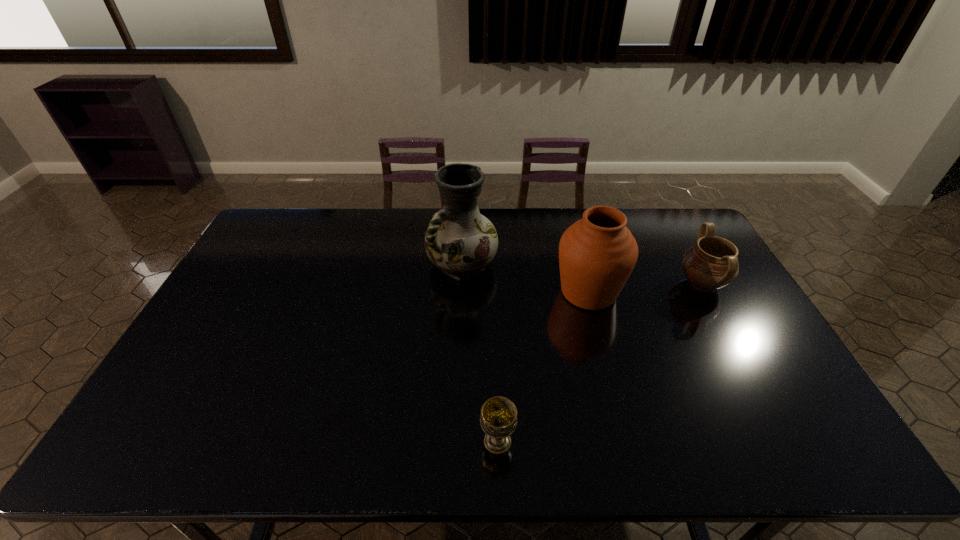
The height and width of the screenshot is (540, 960). In the image, there is a desktop. In order to click on free space at the far right corner in this screenshot , I will do `click(684, 241)`.

Identify the location of unoccupied position between the second object from right to left and the shortest object. The width and height of the screenshot is (960, 540). [x=543, y=367].

Locate an element on the screen. The height and width of the screenshot is (540, 960). vacant space that's between the shorter urn and the taller urn is located at coordinates (645, 288).

Identify the location of vacant area between the nearest object and the tallest object. (480, 353).

The height and width of the screenshot is (540, 960). What are the coordinates of `vacant space that's between the vase and the second tallest object` in the screenshot? It's located at (525, 278).

I want to click on vacant region between the chalice and the rightmost object, so click(x=600, y=362).

At what (x,y) coordinates should I click in order to perform the action: click on blank region between the left urn and the shorter urn. Please return your answer as a coordinate pair (x, y). This screenshot has height=540, width=960. Looking at the image, I should click on (645, 288).

This screenshot has width=960, height=540. Find the location of `empty space between the third shortest object and the nearest object`. empty space between the third shortest object and the nearest object is located at coordinates (543, 367).

I want to click on free spot between the shortest object and the vase, so click(480, 353).

Identify which object is the closest to the tallest object. Please provide its 2D coordinates. Your answer should be formatted as a tuple, i.e. [(x, y)], where the tuple contains the x and y coordinates of a point satisfying the conditions above.

[(597, 254)]